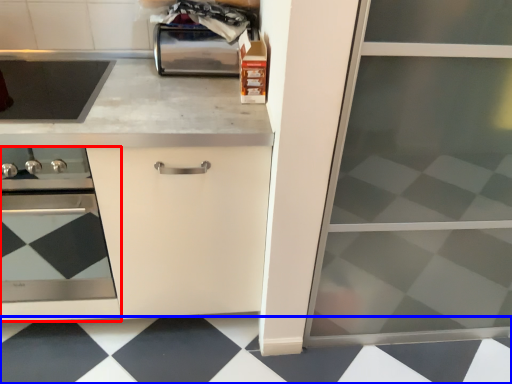
Question: Among these objects, which one is nearest to the camera, home appliance (highlighted by a red box) or tile (highlighted by a blue box)?

Choices:
 (A) home appliance
 (B) tile

Answer: (A)